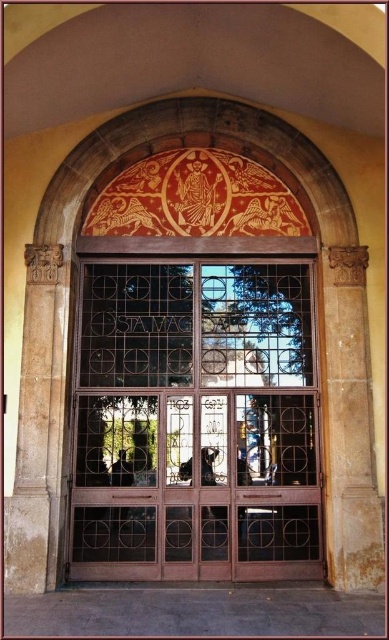
Who is more distant from viewer, (248, 353) or (245, 186)?

Point (245, 186)

Who is more distant from viewer, (287, 461) or (236, 230)?

The point (236, 230) is behind.

Where is `brown metal window at center`? The width and height of the screenshot is (389, 640). brown metal window at center is located at coordinates (196, 422).

Is gold textured tapestry at upper center above rustic stone pillar at left?

Yes, gold textured tapestry at upper center is above rustic stone pillar at left.

Between gold textured tapestry at upper center and rustic stone pillar at left, which one is positioned lower?

Positioned lower is rustic stone pillar at left.

Is point (238, 163) farther from viewer compared to point (47, 369)?

Yes, it is.

The width and height of the screenshot is (389, 640). In order to click on gold textured tapestry at upper center in this screenshot , I will do `click(196, 198)`.

Between point (113, 380) and point (31, 248), which one is positioned in front?

Point (31, 248) is in front.

Which is below, brown metal window at center or rustic stone pillar at left?

brown metal window at center is lower down.

Locate an element on the screen. The image size is (389, 640). brown metal window at center is located at coordinates (196, 422).

The image size is (389, 640). In order to click on brown metal window at center in this screenshot , I will do `click(196, 422)`.